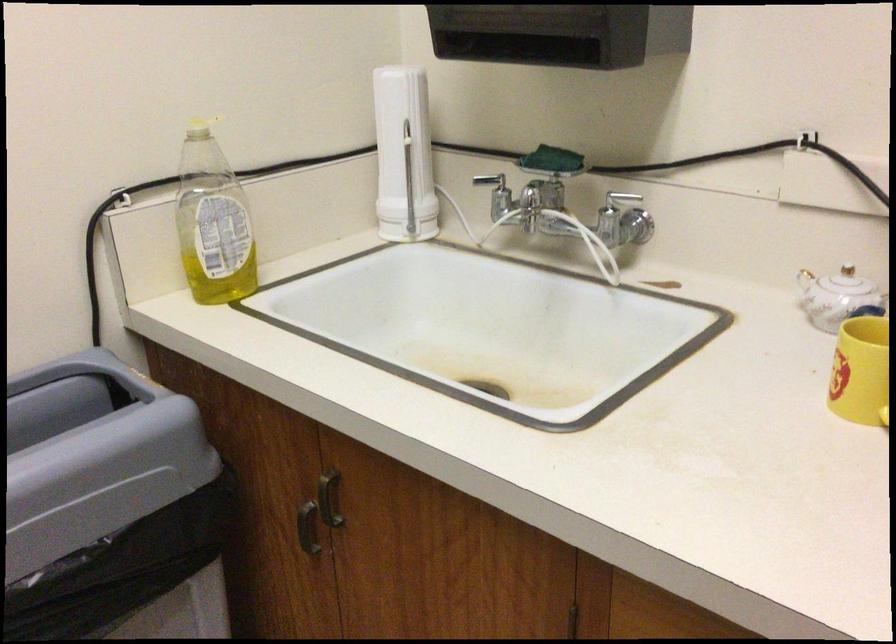
Image resolution: width=896 pixels, height=644 pixels. I want to click on gray trash can lid, so click(95, 436).